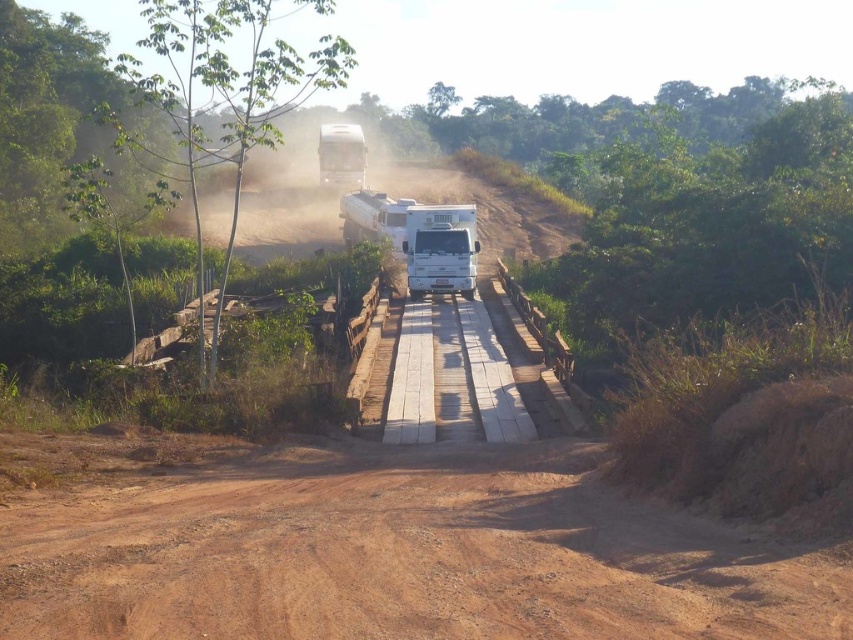
Question: Which point is closer to the camera taking this photo?

Choices:
 (A) (360, 172)
 (B) (438, 275)
 (C) (767, 584)

Answer: (C)

Question: Can you confirm if brown dirt track at center is wider than white matte recreational vehicle at center?

Choices:
 (A) no
 (B) yes

Answer: (B)

Question: Observing the image, what is the correct spatial positioning of brown dirt track at center in reference to white matte truck at center?

Choices:
 (A) left
 (B) right

Answer: (B)

Question: Among these objects, which one is nearest to the camera?

Choices:
 (A) brown dirt track at center
 (B) white matte truck at center

Answer: (A)

Question: Based on their relative distances, which object is nearer to the white matte recreational vehicle at center?

Choices:
 (A) brown dirt track at center
 (B) white matte truck at center

Answer: (A)

Question: Does brown dirt track at center appear on the left side of white matte truck at center?

Choices:
 (A) no
 (B) yes

Answer: (A)